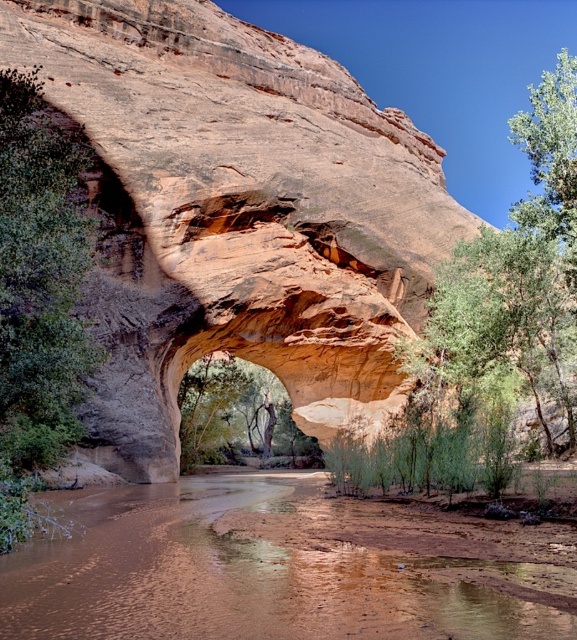
You are standing at the camera position and want to cross the river. The safe distance to cross is at least 40 meters away from the camera. Can you cross the brown sedimentary river at lower center safely?

The brown sedimentary river at lower center is only 35.90 meters from the camera, which is less than the required 40 meters for safe crossing. Therefore, you cannot cross the brown sedimentary river at lower center safely.

You are planning to cross the brown sedimentary river at lower center using a small wooden bridge. However, you notice the green leafy tree at left nearby. Which object occupies more space in the scene?

The green leafy tree at left occupies more space in the scene than the brown sedimentary river at lower center, as the river has a smaller size compared to the tree.

Consider the image. You are standing at the base of the green leafy tree at left and want to cross the brown sedimentary river at lower center. Which direction should you walk to reach the river first?

The brown sedimentary river at lower center is shorter than the green leafy tree at left, so you should walk towards the river directly since it is closer to you than the tree.